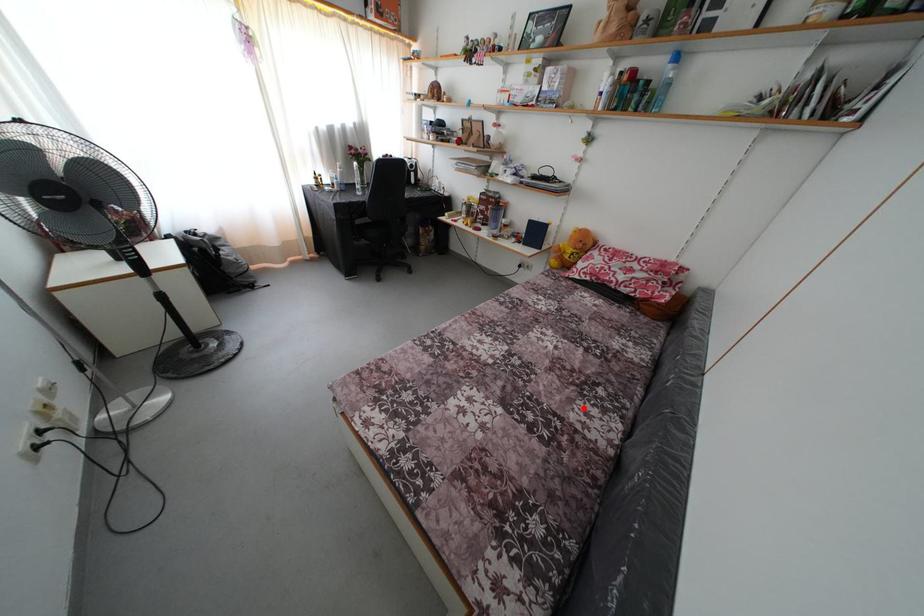
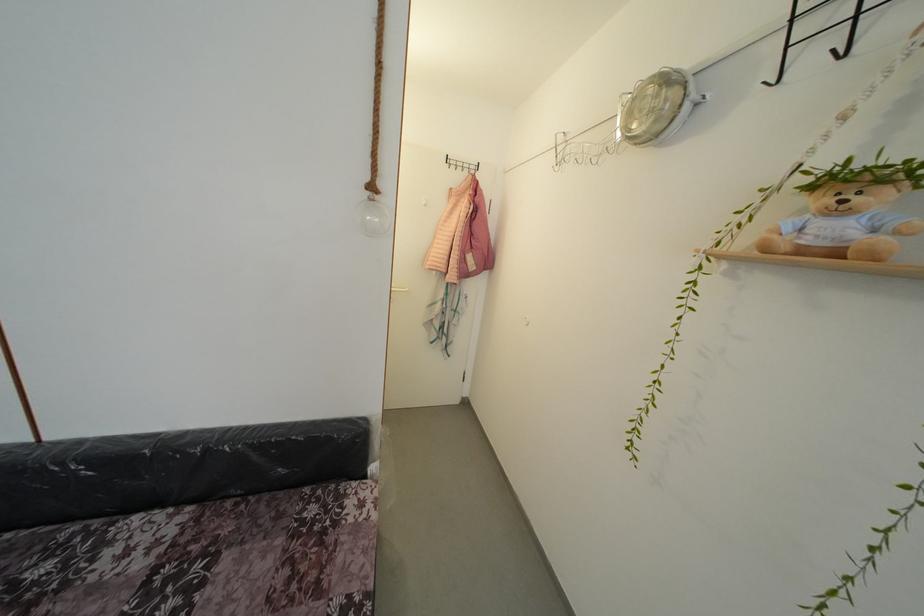
In the second image, find the point that corresponds to the highlighted location in the first image.

(99, 585)